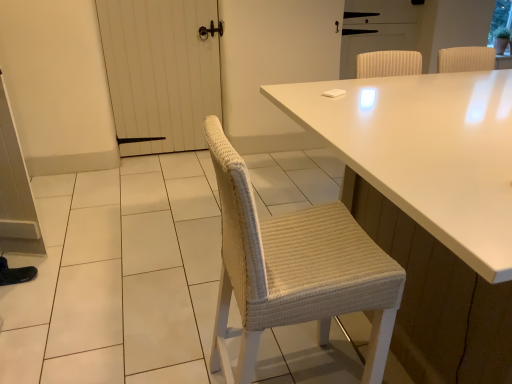
The height and width of the screenshot is (384, 512). I want to click on blank space above white wooden door at left, arranged as the 2th screen door when viewed from the right (from a real-world perspective), so click(x=157, y=0).